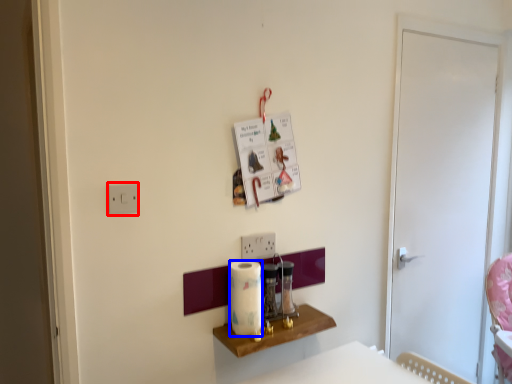
Question: Which object appears closest to the camera in this image, light switch (highlighted by a red box) or paper towel (highlighted by a blue box)?

Choices:
 (A) light switch
 (B) paper towel

Answer: (A)